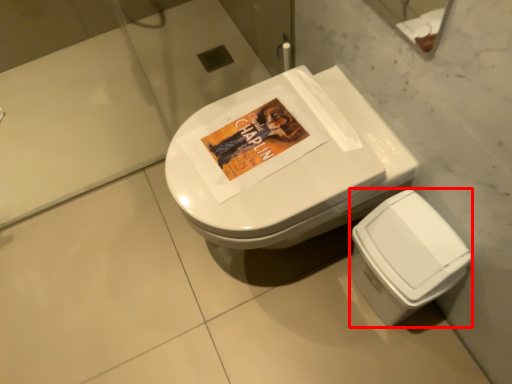
Question: Considering the relative positions of bidet (annotated by the red box) and toilet in the image provided, where is bidet (annotated by the red box) located with respect to the staircase?

Choices:
 (A) left
 (B) right

Answer: (B)